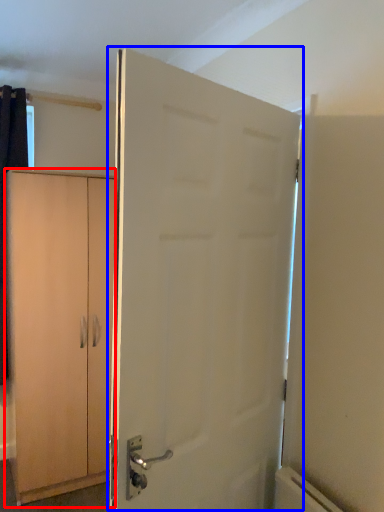
Question: Among these objects, which one is nearest to the camera, cabinetry (highlighted by a red box) or door (highlighted by a blue box)?

Choices:
 (A) cabinetry
 (B) door

Answer: (B)